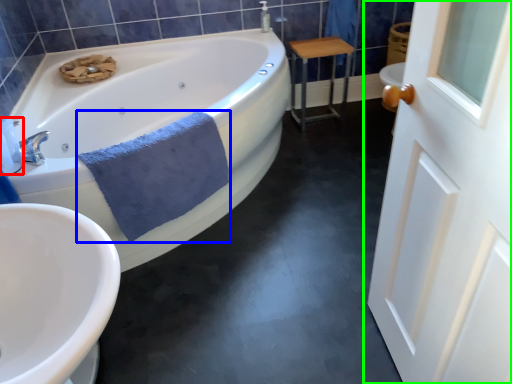
Question: Which object is the farthest from toiletry (highlighted by a red box)? Choose among these: bath towel (highlighted by a blue box) or door (highlighted by a green box).

Choices:
 (A) bath towel
 (B) door

Answer: (B)